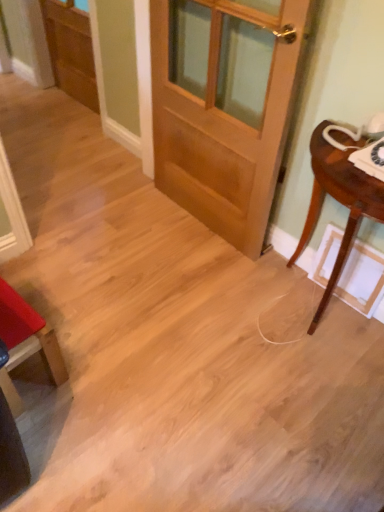
Question: From a real-world perspective, does light brown wood door at center stand above matte red chair at lower left?

Choices:
 (A) yes
 (B) no

Answer: (A)

Question: Could you tell me if light brown wood door at center is turned towards matte red chair at lower left?

Choices:
 (A) yes
 (B) no

Answer: (A)

Question: Considering the relative sizes of light brown wood door at center and matte red chair at lower left in the image provided, is light brown wood door at center wider than matte red chair at lower left?

Choices:
 (A) yes
 (B) no

Answer: (B)

Question: Would you consider light brown wood door at center to be distant from matte red chair at lower left?

Choices:
 (A) no
 (B) yes

Answer: (B)

Question: Is light brown wood door at center surrounding matte red chair at lower left?

Choices:
 (A) yes
 (B) no

Answer: (B)

Question: Considering their positions, is matte red chair at lower left located in front of or behind light brown wood door at center?

Choices:
 (A) front
 (B) behind

Answer: (B)

Question: From the image's perspective, is matte red chair at lower left positioned above or below light brown wood door at center?

Choices:
 (A) below
 (B) above

Answer: (A)

Question: Considering the positions of matte red chair at lower left and light brown wood door at center in the image, is matte red chair at lower left wider or thinner than light brown wood door at center?

Choices:
 (A) wide
 (B) thin

Answer: (A)

Question: Looking at the image, does matte red chair at lower left seem bigger or smaller compared to light brown wood door at center?

Choices:
 (A) big
 (B) small

Answer: (B)

Question: In the image, is wooden screen door at upper left on the left side or the right side of light brown wood door at center?

Choices:
 (A) right
 (B) left

Answer: (B)

Question: Considering the positions of wooden screen door at upper left and light brown wood door at center in the image, is wooden screen door at upper left wider or thinner than light brown wood door at center?

Choices:
 (A) thin
 (B) wide

Answer: (A)

Question: Considering their positions, is wooden screen door at upper left located in front of or behind light brown wood door at center?

Choices:
 (A) behind
 (B) front

Answer: (A)

Question: From the image's perspective, is wooden screen door at upper left above or below light brown wood door at center?

Choices:
 (A) below
 (B) above

Answer: (B)

Question: From a real-world perspective, is light brown wood door at center physically located above or below mahogany wood table at right?

Choices:
 (A) below
 (B) above

Answer: (B)

Question: From the image's perspective, relative to mahogany wood table at right, is light brown wood door at center above or below?

Choices:
 (A) below
 (B) above

Answer: (B)